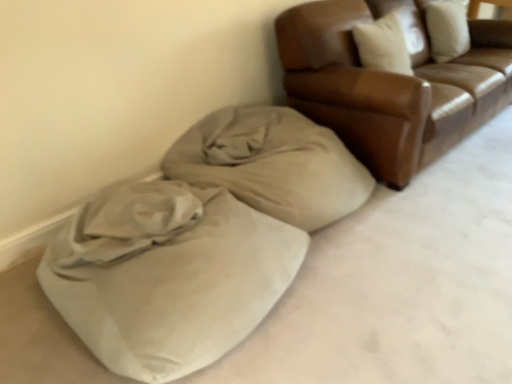
Question: Is beige fabric blanket at lower left bigger or smaller than brown leather couch at upper right?

Choices:
 (A) big
 (B) small

Answer: (B)

Question: From the image's perspective, is beige fabric blanket at lower left above or below brown leather couch at upper right?

Choices:
 (A) below
 (B) above

Answer: (A)

Question: Which object is the closest to the beige fabric blanket at lower left?

Choices:
 (A) suede-like beige bean bag at lower left
 (B) brown leather couch at upper right

Answer: (A)

Question: Based on their relative distances, which object is farther from the beige fabric blanket at lower left?

Choices:
 (A) brown leather couch at upper right
 (B) suede-like beige bean bag at lower left

Answer: (A)